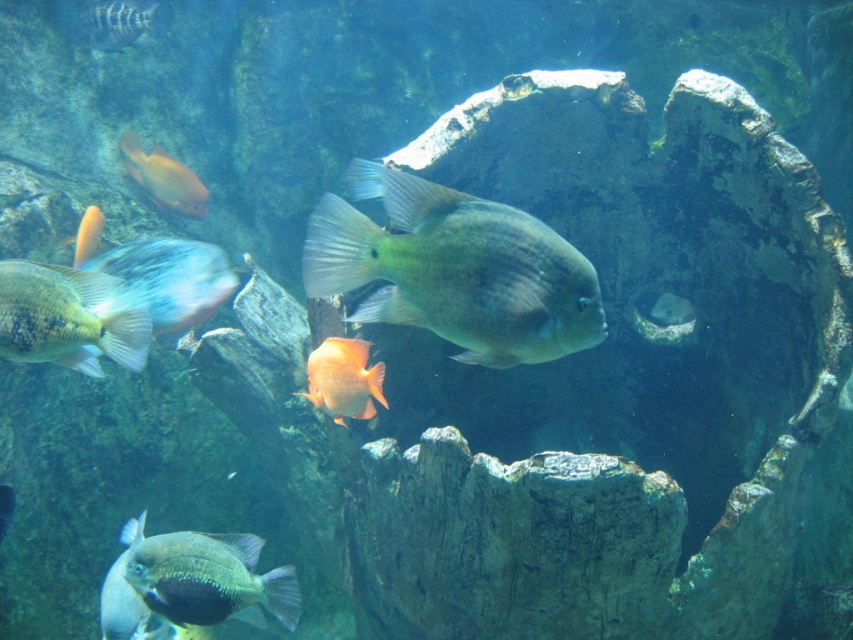
You are an underwater photographer aiming to capture a photo of the shiny blue fish at center and the orange matte fish at left. Based on their sizes, which fish should you focus on if you want to ensure both fit within the frame without cropping?

The shiny blue fish at center is not as tall as the orange matte fish at left, so you should focus on the orange matte fish at left as it is taller and will require more space in the frame to avoid cropping.

You are an underwater photographer aiming to capture a photo of the orange matte fish at center and the orange matte fish at upper left. From your current position, which of these two fish is positioned lower in the water?

The orange matte fish at center is located below the orange matte fish at upper left, so it is positioned lower in the water.

You are a diver exploring the underwater scene. You see the shiny blue fish at lower left and the shiny silver fish at upper left. Which fish is closer to you?

The shiny blue fish at lower left is closer to you because it is only 7.51 feet away from the shiny silver fish at upper left, but the question is about proximity to the observer. Wait, the description says the blue fish is 7.51 feet away from the silver fish, but it doesn not specify their distance from the observer. Hmm, maybe I need to reevaluate. Since the question asks which is closer to the diver, but the given data only provides the distance between the two fish, not their individual distances from.